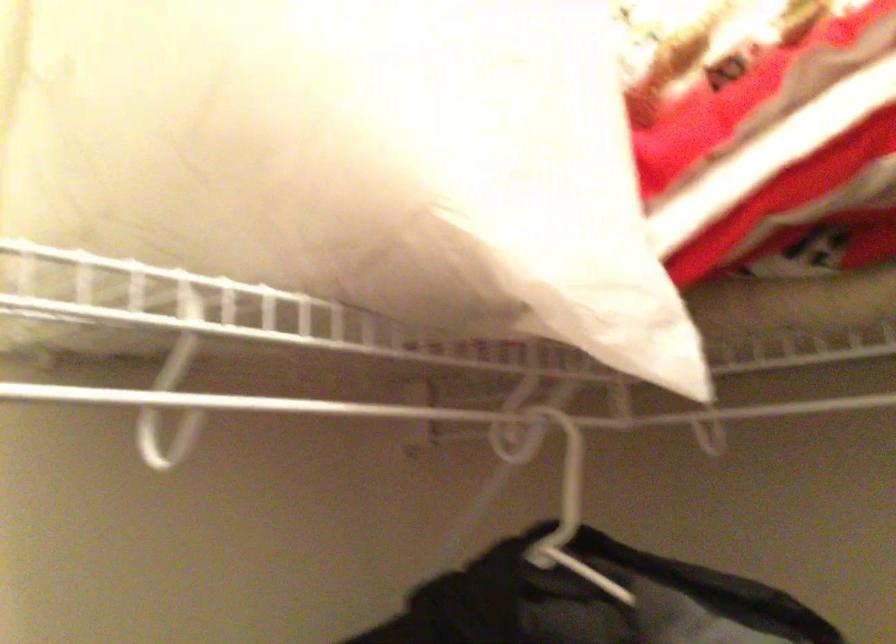
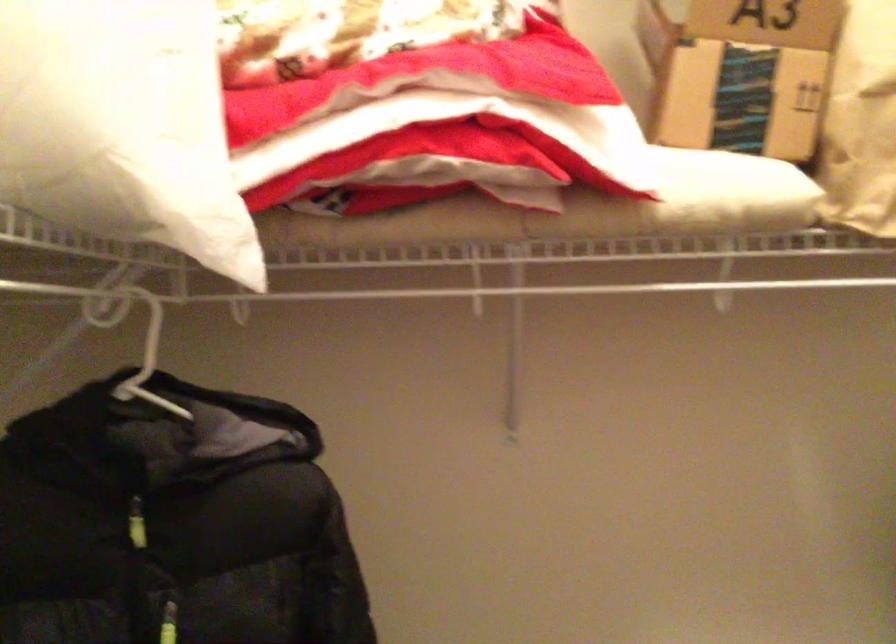
Locate, in the second image, the point that corresponds to (x=609, y=477) in the first image.

(138, 344)